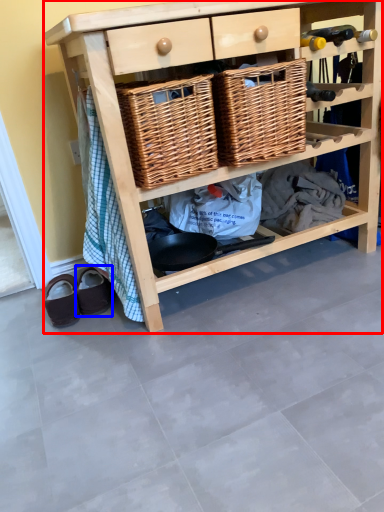
Question: Among these objects, which one is farthest to the camera, shelf (highlighted by a red box) or footwear (highlighted by a blue box)?

Choices:
 (A) shelf
 (B) footwear

Answer: (B)